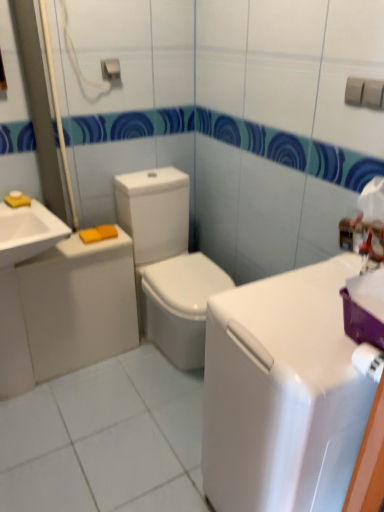
Identify the location of white glossy sink at left. (28, 232).

The height and width of the screenshot is (512, 384). What do you see at coordinates (28, 232) in the screenshot? I see `white glossy sink at left` at bounding box center [28, 232].

The width and height of the screenshot is (384, 512). I want to click on white glossy toilet at center, so coord(167,263).

In the scene shown: Measure the distance between point (285,436) and camera.

A distance of 91.60 centimeters exists between point (285,436) and camera.

What is the approximate height of white glossy toilet at left?

24.76 inches.

I want to click on white glossy sink at left, so click(x=28, y=232).

Considering the points (37, 283) and (39, 223), which point is in front, point (37, 283) or point (39, 223)?

The point (39, 223) is more forward.

How distant is white glossy toilet at left from white glossy sink at left?

29.63 centimeters.

Considering the positions of objects white glossy toilet at left and white glossy sink at left in the image provided, who is more to the right, white glossy toilet at left or white glossy sink at left?

white glossy toilet at left is more to the right.

From a real-world perspective, is white glossy toilet at left physically located above or below metallic silver towel bar at upper center?

From a real-world perspective, white glossy toilet at left is physically below metallic silver towel bar at upper center.

Locate an element on the screen. The width and height of the screenshot is (384, 512). appliance on the left side of metallic silver towel bar at upper center is located at coordinates (79, 304).

From the image's perspective, which is above, white glossy toilet at left or metallic silver towel bar at upper center?

metallic silver towel bar at upper center appears higher in the image.

Which is more to the right, white glossy toilet at left or metallic silver towel bar at upper center?

metallic silver towel bar at upper center is more to the right.

Is point (301, 504) positioned before point (115, 62)?

Yes.

From a real-world perspective, is white glossy counter top at center beneath metallic silver towel bar at upper center?

Correct, in the physical world, white glossy counter top at center is lower than metallic silver towel bar at upper center.

Can you tell me how much white glossy counter top at center and metallic silver towel bar at upper center differ in facing direction?

They differ by 91.1 degrees in their facing directions.

Can you confirm if white glossy counter top at center is positioned to the right of metallic silver towel bar at upper center?

Indeed, white glossy counter top at center is positioned on the right side of metallic silver towel bar at upper center.

Is white glossy counter top at center directly adjacent to white glossy sink at left?

There is a gap between white glossy counter top at center and white glossy sink at left.

Is white glossy counter top at center bigger than white glossy sink at left?

Yes, white glossy counter top at center is bigger than white glossy sink at left.

Would you say white glossy counter top at center is outside white glossy sink at left?

Absolutely, white glossy counter top at center is external to white glossy sink at left.

Considering the positions of objects white glossy counter top at center and white glossy sink at left in the image provided, who is in front, white glossy counter top at center or white glossy sink at left?

Positioned in front is white glossy counter top at center.

Which is behind, point (25, 237) or point (126, 343)?

Positioned behind is point (126, 343).

What's the angular difference between white glossy sink at left and white glossy toilet at left's facing directions?

They differ by 1.22 degrees in their facing directions.

Locate an element on the screen. The height and width of the screenshot is (512, 384). appliance on the right of white glossy sink at left is located at coordinates (79, 304).

From a real-world perspective, is white glossy sink at left on top of white glossy toilet at left?

Yes.

Between white glossy sink at left and white glossy counter top at center, which one has smaller size?

Smaller between the two is white glossy sink at left.

From the image's perspective, is white glossy sink at left on top of white glossy counter top at center?

Yes, from the image's perspective, white glossy sink at left is above white glossy counter top at center.

How much distance is there between white glossy sink at left and white glossy counter top at center?

white glossy sink at left and white glossy counter top at center are 37.95 inches apart from each other.

In the image, is white glossy sink at left positioned in front of or behind white glossy counter top at center?

white glossy sink at left is behind white glossy counter top at center.

Between metallic silver towel bar at upper center and white glossy sink at left, which one is positioned behind?

metallic silver towel bar at upper center.

Does point (118, 69) lie in front of point (28, 258)?

No, it is behind (28, 258).

Looking at this image, between metallic silver towel bar at upper center and white glossy sink at left, which one has larger width?

With larger width is white glossy sink at left.

The height and width of the screenshot is (512, 384). Identify the location of appliance below the white glossy sink at left (from a real-world perspective). (79, 304).

The width and height of the screenshot is (384, 512). Find the location of `appliance on the left of metallic silver towel bar at upper center`. appliance on the left of metallic silver towel bar at upper center is located at coordinates (79, 304).

Looking at the image, which one is located further to white glossy counter top at center, metallic silver towel bar at upper center or white glossy toilet at center?

metallic silver towel bar at upper center is positioned further to the anchor white glossy counter top at center.

Considering their positions, is white glossy toilet at center positioned further to metallic silver towel bar at upper center than white glossy toilet at left?

The object further to metallic silver towel bar at upper center is white glossy toilet at left.

Which object lies further to the anchor point metallic silver towel bar at upper center, white glossy toilet at left or white glossy sink at left?

white glossy toilet at left.

From the image, which object appears to be farther from white glossy toilet at center, white glossy sink at left or metallic silver towel bar at upper center?

metallic silver towel bar at upper center is further to white glossy toilet at center.

Estimate the real-world distances between objects in this image. Which object is further from white glossy counter top at center, metallic silver towel bar at upper center or white glossy toilet at left?

metallic silver towel bar at upper center.

Consider the image. Estimate the real-world distances between objects in this image. Which object is closer to white glossy toilet at center, metallic silver towel bar at upper center or white glossy sink at left?

white glossy sink at left lies closer to white glossy toilet at center than the other object.

Looking at this image, looking at the image, which one is located further to metallic silver towel bar at upper center, white glossy counter top at center or white glossy toilet at center?

Based on the image, white glossy counter top at center appears to be further to metallic silver towel bar at upper center.

From the image, which object appears to be nearer to white glossy counter top at center, white glossy toilet at center or metallic silver towel bar at upper center?

The object closer to white glossy counter top at center is white glossy toilet at center.

The width and height of the screenshot is (384, 512). What are the coordinates of `appliance between metallic silver towel bar at upper center and white glossy counter top at center in the up-down direction` in the screenshot? It's located at (79, 304).

This screenshot has width=384, height=512. In order to click on toilet between metallic silver towel bar at upper center and white glossy counter top at center in the vertical direction in this screenshot , I will do `click(167, 263)`.

You are a GUI agent. You are given a task and a screenshot of the screen. Output one action in this format:
    pyautogui.click(x=<x>, y=<y>)
    Task: Click on the sink between metallic silver towel bar at upper center and white glossy toilet at left in the vertical direction
    The height and width of the screenshot is (512, 384).
    Given the screenshot: What is the action you would take?
    pyautogui.click(x=28, y=232)

Find the location of a particular element. The image size is (384, 512). toilet located between white glossy toilet at left and white glossy counter top at center in the left-right direction is located at coordinates (167, 263).